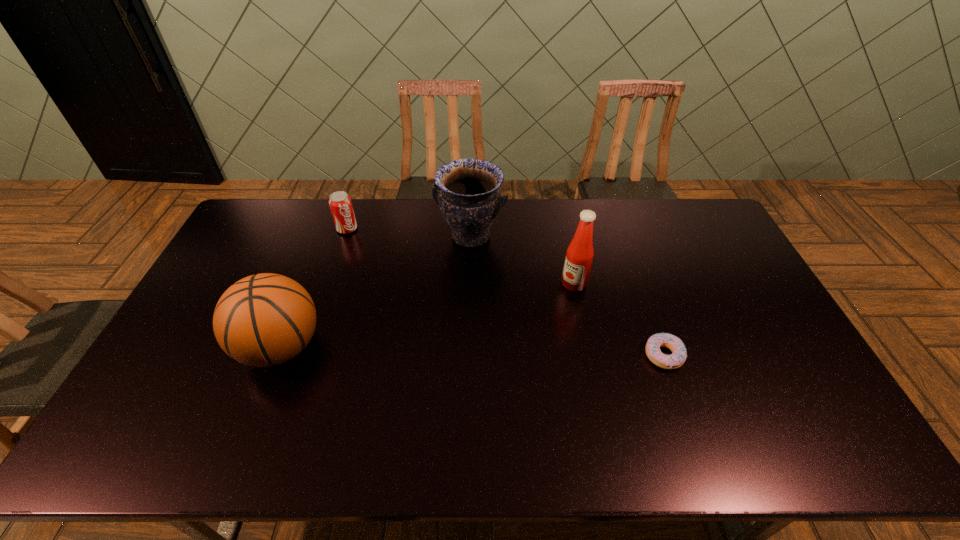
The height and width of the screenshot is (540, 960). Find the location of `basketball`. basketball is located at coordinates (263, 320).

This screenshot has width=960, height=540. Identify the location of the shortest object. (679, 354).

Locate an element on the screen. Image resolution: width=960 pixels, height=540 pixels. doughnut is located at coordinates (679, 354).

You are a GUI agent. You are given a task and a screenshot of the screen. Output one action in this format:
    pyautogui.click(x=<x>, y=<y>)
    Task: Click on the pottery
    
    Given the screenshot: What is the action you would take?
    pyautogui.click(x=466, y=190)

Image resolution: width=960 pixels, height=540 pixels. I want to click on the fourth tallest object, so click(x=340, y=203).

Locate an element on the screen. Image resolution: width=960 pixels, height=540 pixels. the third farthest object is located at coordinates (579, 256).

Identify the location of the fourth object from left to right. This screenshot has height=540, width=960. (579, 256).

I want to click on free region located on the right of the basketball, so click(352, 347).

Image resolution: width=960 pixels, height=540 pixels. Find the location of `free space located 0.260m on the right of the doughnut`. free space located 0.260m on the right of the doughnut is located at coordinates point(776,355).

This screenshot has width=960, height=540. Identify the location of blank space located 0.230m on the front handle of the pottery. (439, 305).